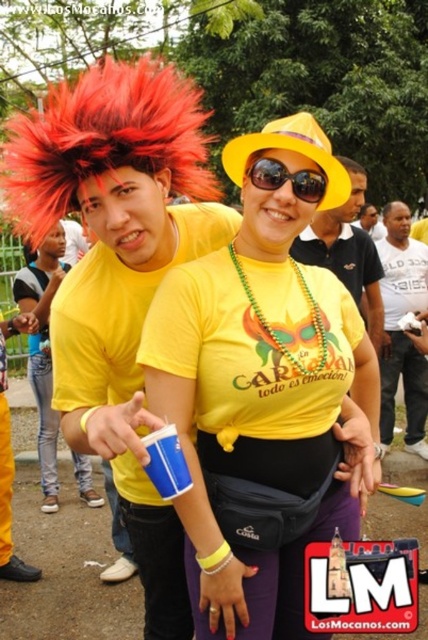
Can you confirm if yellow matte cup at center is thinner than matte yellow shirt at center?

No, yellow matte cup at center is not thinner than matte yellow shirt at center.

Which of these two, yellow matte cup at center or matte yellow shirt at center, stands shorter?

Standing shorter between the two is matte yellow shirt at center.

Where is `yellow matte cup at center`? This screenshot has width=428, height=640. yellow matte cup at center is located at coordinates (42, 348).

This screenshot has width=428, height=640. What are the coordinates of `yellow matte cup at center` in the screenshot? It's located at (42, 348).

Does yellow matte cup at center appear under sunglasses at center?

Correct, yellow matte cup at center is located below sunglasses at center.

Describe the element at coordinates (42, 348) in the screenshot. The width and height of the screenshot is (428, 640). I see `yellow matte cup at center` at that location.

The height and width of the screenshot is (640, 428). Identify the location of yellow matte cup at center. (42, 348).

Does yellow matte shirt at center have a lesser width compared to matte yellow shirt at center?

No, yellow matte shirt at center is not thinner than matte yellow shirt at center.

The height and width of the screenshot is (640, 428). What do you see at coordinates (259, 392) in the screenshot?
I see `yellow matte shirt at center` at bounding box center [259, 392].

Find the location of a particular element. This screenshot has width=428, height=640. yellow matte shirt at center is located at coordinates (259, 392).